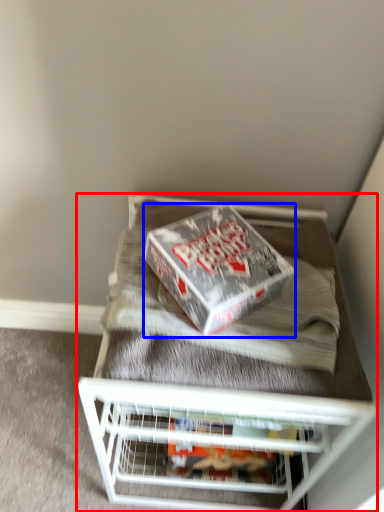
Question: Which object is closer to the camera taking this photo, furniture (highlighted by a red box) or box (highlighted by a blue box)?

Choices:
 (A) furniture
 (B) box

Answer: (B)